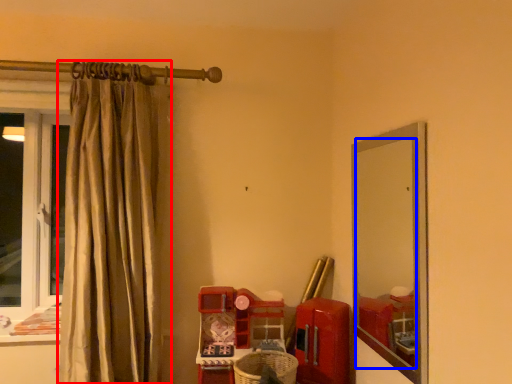
Question: Which object is closer to the camera taking this photo, curtain (highlighted by a red box) or mirror (highlighted by a blue box)?

Choices:
 (A) curtain
 (B) mirror

Answer: (B)